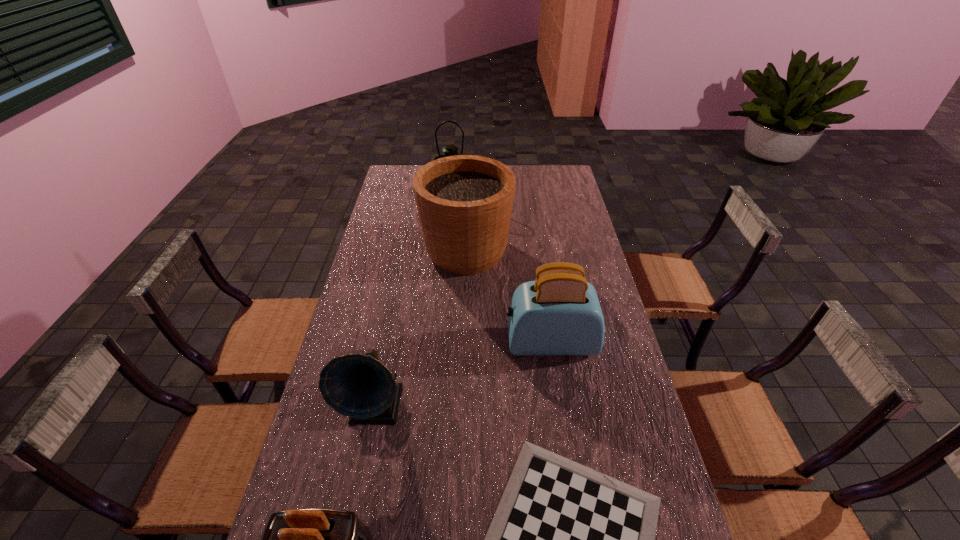
Find the location of a particular element. This screenshot has width=960, height=540. free space between the taller toaster and the flowerpot is located at coordinates (508, 297).

You are a GUI agent. You are given a task and a screenshot of the screen. Output one action in this format:
    pyautogui.click(x=<x>, y=<y>)
    Task: Click on the vacant region between the taller toaster and the farthest object
    This screenshot has height=540, width=960.
    Given the screenshot: What is the action you would take?
    pyautogui.click(x=501, y=268)

Identify which object is the closest to the farthest object. Please provide its 2D coordinates. Your answer should be formatted as a tuple, i.e. [(x, y)], where the tuple contains the x and y coordinates of a point satisfying the conditions above.

[(464, 202)]

Identify which object is the fourth closest to the farthest object. Please provide its 2D coordinates. Your answer should be formatted as a tuple, i.e. [(x, y)], where the tuple contains the x and y coordinates of a point satisfying the conditions above.

[(565, 539)]

At what (x,y) coordinates should I click in order to perform the action: click on vacant space that satisfies the following two spatial constraints: 1. on the side where the farthest object emits light; 2. on the right side of the flowerpot. Please return your answer as a coordinate pair (x, y). Looking at the image, I should click on (447, 252).

Locate an element on the screen. free region that satisfies the following two spatial constraints: 1. on the side where the farthest object emits light; 2. on the right side of the flowerpot is located at coordinates (447, 252).